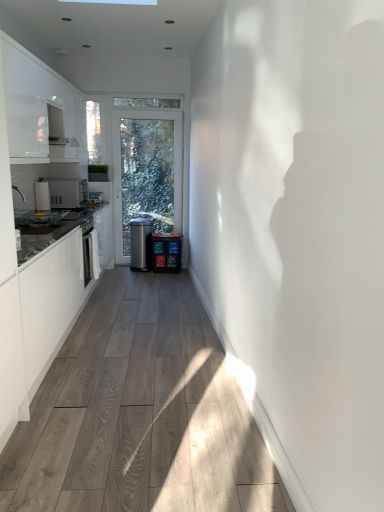
Question: Does satin silver microwave at left appear on the right side of white glossy cabinet at upper left?

Choices:
 (A) no
 (B) yes

Answer: (A)

Question: Is satin silver microwave at left positioned beyond the bounds of white glossy cabinet at upper left?

Choices:
 (A) no
 (B) yes

Answer: (B)

Question: Is satin silver microwave at left positioned with its back to white glossy cabinet at upper left?

Choices:
 (A) no
 (B) yes

Answer: (A)

Question: Is satin silver microwave at left bigger than white glossy cabinet at upper left?

Choices:
 (A) yes
 (B) no

Answer: (B)

Question: Considering the relative sizes of satin silver microwave at left and white glossy cabinet at upper left in the image provided, is satin silver microwave at left wider than white glossy cabinet at upper left?

Choices:
 (A) no
 (B) yes

Answer: (B)

Question: Does satin silver microwave at left have a lesser width compared to white glossy cabinet at upper left?

Choices:
 (A) no
 (B) yes

Answer: (A)

Question: Is satin silver water cooler at center, arranged as the 1th water cooler when viewed from the left, oriented towards wooden floor at center?

Choices:
 (A) no
 (B) yes

Answer: (B)

Question: Considering the relative positions of satin silver water cooler at center, positioned as the 2th water cooler in right-to-left order, and wooden floor at center in the image provided, is satin silver water cooler at center, positioned as the 2th water cooler in right-to-left order, to the right of wooden floor at center from the viewer's perspective?

Choices:
 (A) yes
 (B) no

Answer: (B)

Question: Is wooden floor at center located within satin silver water cooler at center, positioned as the 2th water cooler in right-to-left order?

Choices:
 (A) yes
 (B) no

Answer: (B)

Question: From a real-world perspective, is satin silver water cooler at center, positioned as the 2th water cooler in right-to-left order, physically above wooden floor at center?

Choices:
 (A) no
 (B) yes

Answer: (B)

Question: Is satin silver water cooler at center, positioned as the 2th water cooler in right-to-left order, far from wooden floor at center?

Choices:
 (A) yes
 (B) no

Answer: (A)

Question: From a real-world perspective, is satin silver water cooler at center, positioned as the 2th water cooler in right-to-left order, positioned under wooden floor at center based on gravity?

Choices:
 (A) yes
 (B) no

Answer: (B)

Question: From a real-world perspective, is satin silver water cooler at center, positioned as the 2th water cooler in right-to-left order, under satin silver microwave at left?

Choices:
 (A) no
 (B) yes

Answer: (B)